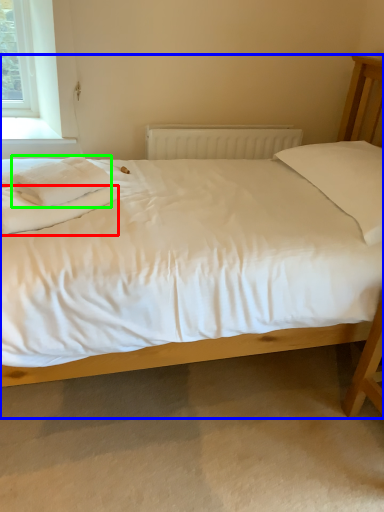
Question: Estimate the real-world distances between objects in this image. Which object is closer to sheet (highlighted by a red box), bed (highlighted by a blue box) or material (highlighted by a green box)?

Choices:
 (A) bed
 (B) material

Answer: (B)